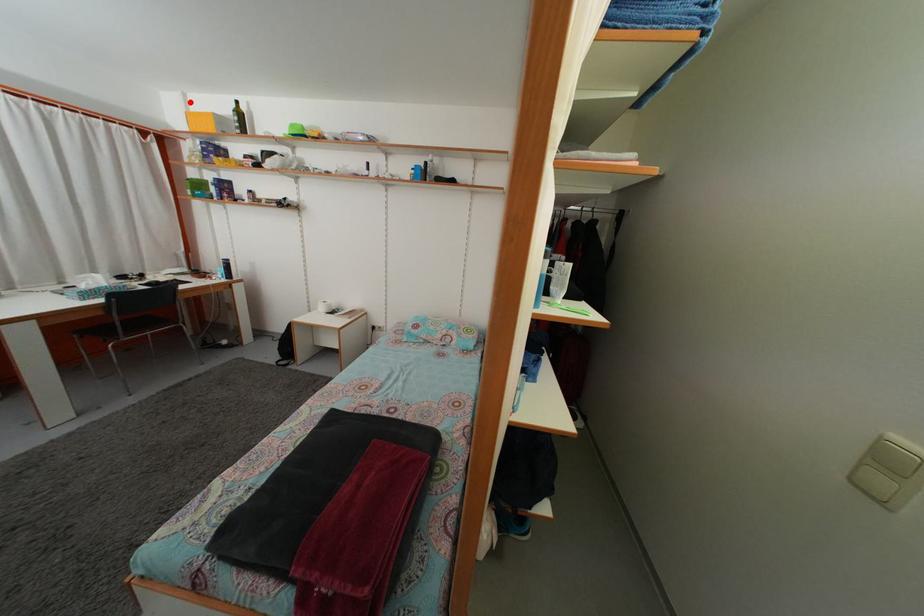
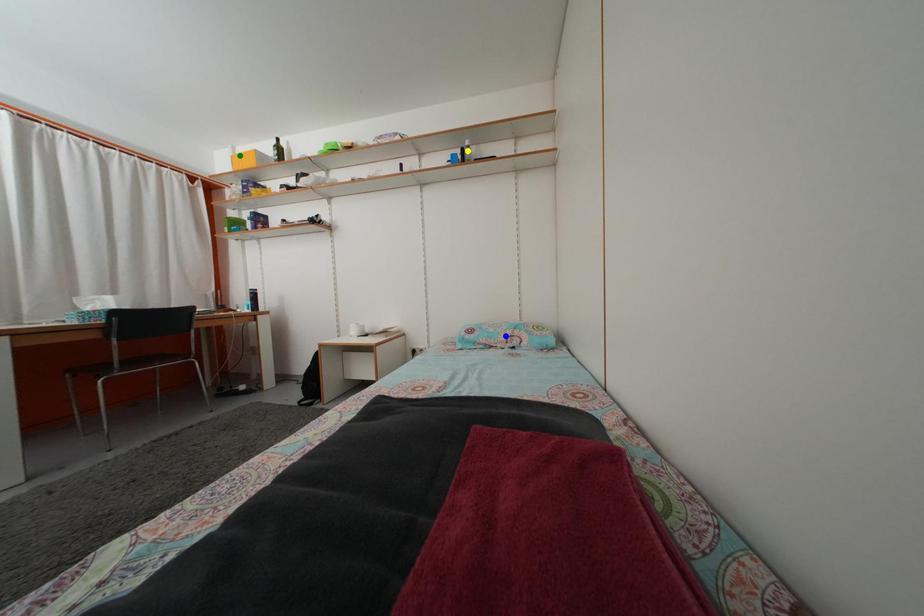
Question: I am providing you with two images of the same scene from different viewpoints. A red point is marked on the first image. You are given multiple points on the second image. Which mark in image 2 goes with the point in image 1?

Choices:
 (A) yellow point
 (B) green point
 (C) blue point

Answer: (B)